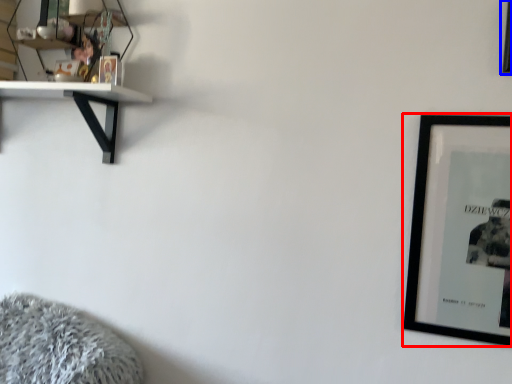
Question: Among these objects, which one is farthest to the camera, picture frame (highlighted by a red box) or picture frame (highlighted by a blue box)?

Choices:
 (A) picture frame
 (B) picture frame

Answer: (A)